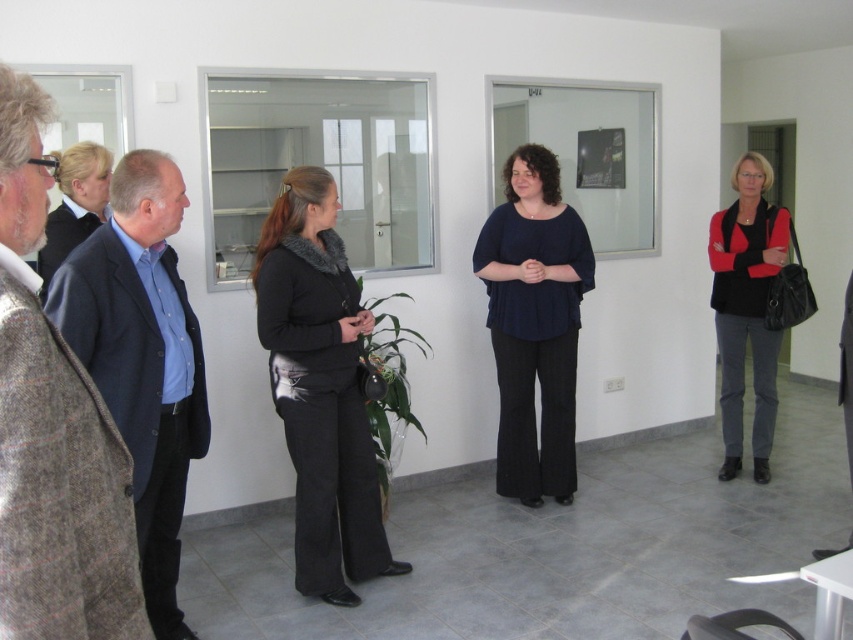
Consider the image. Is dark blue fabric blouse at center to the right of black fabric jacket at left from the viewer's perspective?

Correct, you'll find dark blue fabric blouse at center to the right of black fabric jacket at left.

Can you confirm if dark blue fabric blouse at center is thinner than black fabric jacket at left?

No.

Find the location of `dark blue fabric blouse at center`. dark blue fabric blouse at center is located at coordinates (534, 323).

Which of these two, dark blue suit at left or matte black sweater at right, stands shorter?

dark blue suit at left is shorter.

Which is behind, point (131, 275) or point (764, 172)?

The point (764, 172) is more distant.

The height and width of the screenshot is (640, 853). What do you see at coordinates (142, 358) in the screenshot? I see `dark blue suit at left` at bounding box center [142, 358].

Image resolution: width=853 pixels, height=640 pixels. I want to click on dark blue suit at left, so (x=142, y=358).

Who is positioned more to the left, black matte pants at center or black fabric jacket at left?

From the viewer's perspective, black fabric jacket at left appears more on the left side.

Does black matte pants at center have a smaller size compared to black fabric jacket at left?

No, black matte pants at center is not smaller than black fabric jacket at left.

Which is in front, point (299, 355) or point (102, 147)?

Point (299, 355) is in front.

Identify the location of black matte pants at center. (320, 388).